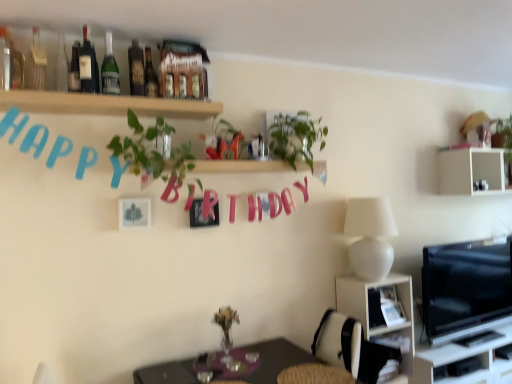
Question: Is clear glass bottle at upper left, the second bottle in the left-to-right sequence, shorter than green leafy plant at upper center?

Choices:
 (A) no
 (B) yes

Answer: (B)

Question: Are clear glass bottle at upper left, the second bottle in the left-to-right sequence, and green leafy plant at upper center beside each other?

Choices:
 (A) yes
 (B) no

Answer: (B)

Question: Is the position of clear glass bottle at upper left, the second bottle in the left-to-right sequence, less distant than that of green leafy plant at upper center?

Choices:
 (A) yes
 (B) no

Answer: (A)

Question: Is clear glass bottle at upper left, the 7th bottle when ordered from right to left, aimed at green leafy plant at upper center?

Choices:
 (A) yes
 (B) no

Answer: (B)

Question: Considering the relative sizes of clear glass bottle at upper left, the 7th bottle when ordered from right to left, and green leafy plant at upper center in the image provided, is clear glass bottle at upper left, the 7th bottle when ordered from right to left, bigger than green leafy plant at upper center?

Choices:
 (A) no
 (B) yes

Answer: (A)

Question: In terms of width, does matte glass bottle at upper left, arranged as the 4th bottle when viewed from the right, look wider or thinner when compared to green leafy plant at upper center?

Choices:
 (A) wide
 (B) thin

Answer: (B)

Question: Considering the positions of matte glass bottle at upper left, the 5th bottle when ordered from left to right, and green leafy plant at upper center in the image, is matte glass bottle at upper left, the 5th bottle when ordered from left to right, bigger or smaller than green leafy plant at upper center?

Choices:
 (A) big
 (B) small

Answer: (B)

Question: Does point (82, 71) appear closer or farther from the camera than point (283, 155)?

Choices:
 (A) closer
 (B) farther

Answer: (A)

Question: From a real-world perspective, is matte glass bottle at upper left, the 5th bottle when ordered from left to right, physically located above or below green leafy plant at upper center?

Choices:
 (A) above
 (B) below

Answer: (A)

Question: Choose the correct answer: Is matte black bottle at upper center, the second bottle viewed from the right, inside white matte table lamp at right or outside it?

Choices:
 (A) outside
 (B) inside

Answer: (A)

Question: Considering the relative positions of matte black bottle at upper center, placed as the 7th bottle when sorted from left to right, and white matte table lamp at right in the image provided, is matte black bottle at upper center, placed as the 7th bottle when sorted from left to right, to the left or to the right of white matte table lamp at right?

Choices:
 (A) right
 (B) left

Answer: (B)

Question: Considering the positions of matte black bottle at upper center, placed as the 7th bottle when sorted from left to right, and white matte table lamp at right in the image, is matte black bottle at upper center, placed as the 7th bottle when sorted from left to right, bigger or smaller than white matte table lamp at right?

Choices:
 (A) big
 (B) small

Answer: (B)

Question: Looking at their shapes, would you say matte black bottle at upper center, placed as the 7th bottle when sorted from left to right, is wider or thinner than white matte table lamp at right?

Choices:
 (A) wide
 (B) thin

Answer: (B)

Question: From the image's perspective, is matte black bottle at upper center, placed as the 7th bottle when sorted from left to right, positioned above or below green glass bottle at upper left, which appears as the 6th bottle when viewed from the left?

Choices:
 (A) above
 (B) below

Answer: (B)

Question: Looking at their shapes, would you say matte black bottle at upper center, the second bottle viewed from the right, is wider or thinner than green glass bottle at upper left, which appears as the 6th bottle when viewed from the left?

Choices:
 (A) wide
 (B) thin

Answer: (A)